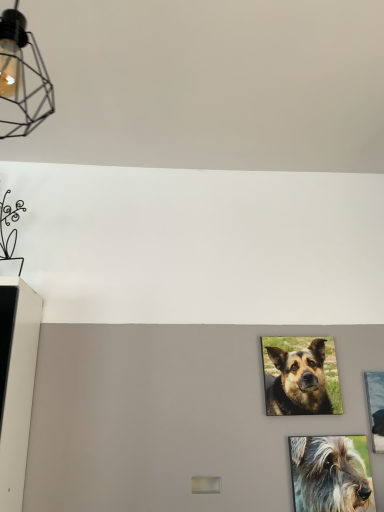
Question: From the image's perspective, would you say matte black wireframe light fixture at upper left is positioned over metallic silver picture frame at right?

Choices:
 (A) no
 (B) yes

Answer: (B)

Question: Is matte black wireframe light fixture at upper left facing away from metallic silver picture frame at right?

Choices:
 (A) no
 (B) yes

Answer: (A)

Question: Does matte black wireframe light fixture at upper left have a smaller size compared to metallic silver picture frame at right?

Choices:
 (A) yes
 (B) no

Answer: (B)

Question: Is matte black wireframe light fixture at upper left located outside metallic silver picture frame at right?

Choices:
 (A) no
 (B) yes

Answer: (B)

Question: Is matte black wireframe light fixture at upper left taller than metallic silver picture frame at right?

Choices:
 (A) yes
 (B) no

Answer: (A)

Question: Can you confirm if matte black wireframe light fixture at upper left is bigger than metallic silver picture frame at right?

Choices:
 (A) yes
 (B) no

Answer: (A)

Question: Is shaggy gray dog at lower right, which is the 1th dog in front-to-back order, positioned behind brown fur dog at center, which is counted as the 1th dog, starting from the back?

Choices:
 (A) yes
 (B) no

Answer: (B)

Question: From the image's perspective, is shaggy gray dog at lower right, which is counted as the 1th dog, starting from the bottom, under brown fur dog at center, which is counted as the 1th dog, starting from the top?

Choices:
 (A) no
 (B) yes

Answer: (B)

Question: Is brown fur dog at center, which is the second dog from front to back, located within shaggy gray dog at lower right, which is counted as the 1th dog, starting from the bottom?

Choices:
 (A) yes
 (B) no

Answer: (B)

Question: Is shaggy gray dog at lower right, which ranks as the second dog in back-to-front order, thinner than brown fur dog at center, which is counted as the 1th dog, starting from the back?

Choices:
 (A) no
 (B) yes

Answer: (B)

Question: Is shaggy gray dog at lower right, which is the second dog from top to bottom, completely or partially outside of brown fur dog at center, which is the second dog from front to back?

Choices:
 (A) yes
 (B) no

Answer: (A)

Question: From the image's perspective, is shaggy gray dog at lower right, which is counted as the 1th dog, starting from the bottom, above brown fur dog at center, which is counted as the 1th dog, starting from the top?

Choices:
 (A) no
 (B) yes

Answer: (A)

Question: Is brown fur dog at center, which is counted as the 1th dog, starting from the back, further to the viewer compared to metallic silver picture frame at right?

Choices:
 (A) no
 (B) yes

Answer: (B)